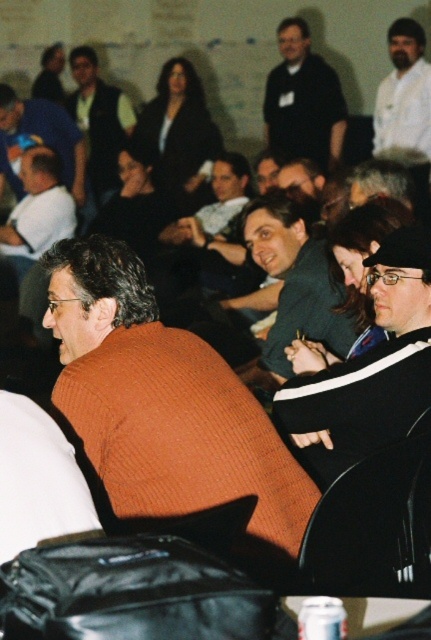
Between matte blue shirt at center and dark brown hair at center, which one appears on the left side from the viewer's perspective?

From the viewer's perspective, matte blue shirt at center appears more on the left side.

Between point (59, 124) and point (127, 173), which one is positioned behind?

Positioned behind is point (59, 124).

Identify the location of matte blue shirt at center. (38, 140).

Does smooth black hair at center appear over dark brown hair at center?

Actually, smooth black hair at center is below dark brown hair at center.

Who is shorter, smooth black hair at center or dark brown hair at center?

smooth black hair at center is shorter.

What do you see at coordinates (364, 259) in the screenshot?
I see `smooth black hair at center` at bounding box center [364, 259].

Locate an element on the screen. The height and width of the screenshot is (640, 431). smooth black hair at center is located at coordinates (364, 259).

Does matte black jacket at center appear on the right side of white shirt at upper right?

No, matte black jacket at center is not to the right of white shirt at upper right.

Is matte black jacket at center wider than white shirt at upper right?

Indeed, matte black jacket at center has a greater width compared to white shirt at upper right.

Which is behind, point (196, 161) or point (427, 108)?

Positioned behind is point (196, 161).

Locate an element on the screen. This screenshot has height=640, width=431. matte black jacket at center is located at coordinates (177, 129).